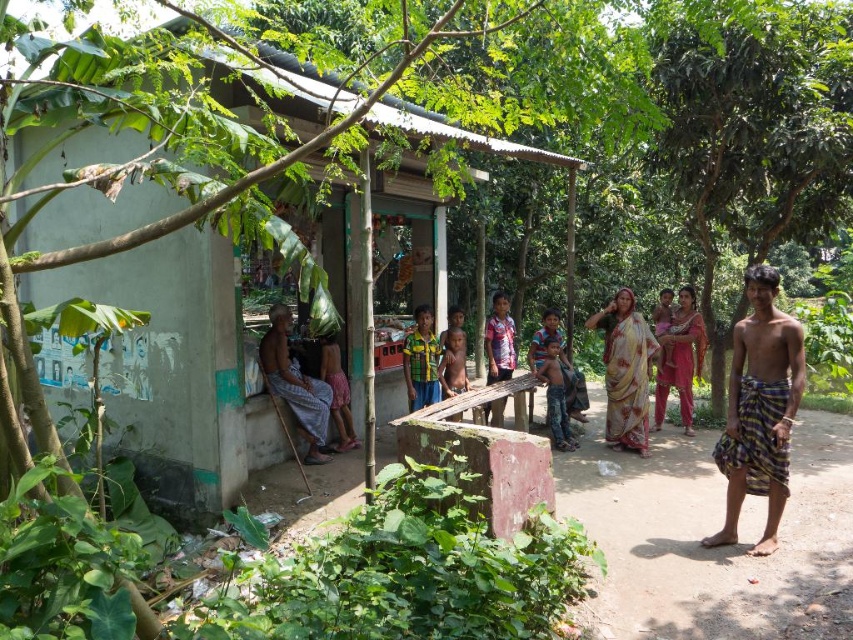
From the picture: You are standing in the rural scene and want to move from the blue striped shirt at center to the green leafy tree at right. Which direction should you walk to reach the tree?

The green leafy tree at right is to the right of the blue striped shirt at center, so you should walk to the right to reach the tree.

You are a photographer trying to capture a group photo of the people at the rural gathering. You need to ensure everyone fits in the frame. The light brown fabric at center and the blue striped shirt at center are two key subjects. Given the distance between them, can you estimate if a standard camera with a 50mm lens can fit both subjects in the frame when standing 10 feet away?

The distance between the light brown fabric at center and the blue striped shirt at center is 7.73 feet. A standard 50mm lens has a field of view that can typically accommodate subjects spaced about 7.73 feet apart at 10 feet distance, so both should fit within the frame.